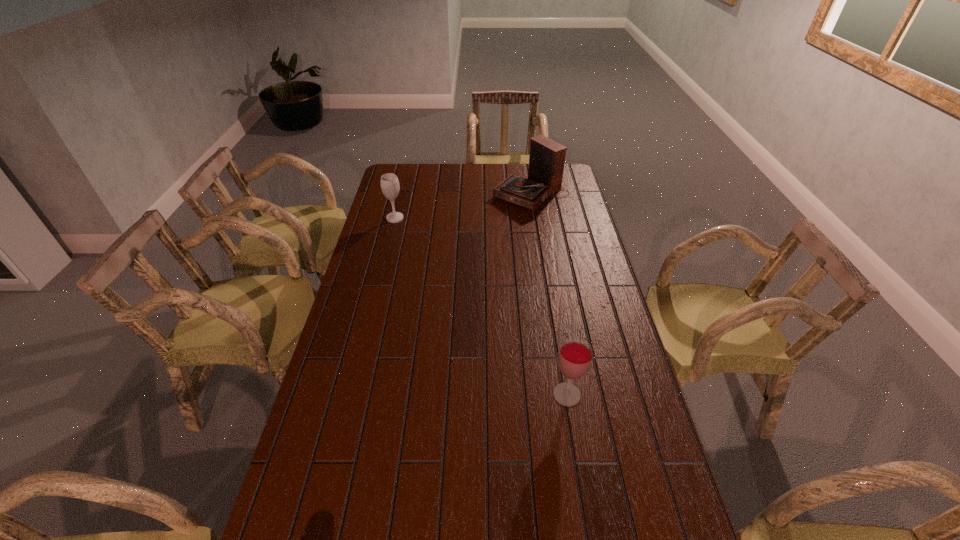
Locate an element on the screen. This screenshot has width=960, height=540. phonograph record is located at coordinates (546, 160).

At what (x,y) coordinates should I click in order to perform the action: click on the second farthest object. Please return your answer as a coordinate pair (x, y). The width and height of the screenshot is (960, 540). Looking at the image, I should click on (390, 187).

Identify the location of the farther wineglass. This screenshot has height=540, width=960. (390, 187).

Locate an element on the screen. the nearest object is located at coordinates [575, 356].

Locate an element on the screen. The width and height of the screenshot is (960, 540). the right wineglass is located at coordinates (575, 356).

Find the location of a particular element. The image size is (960, 540). free location located 0.320m on the front of the farthest object is located at coordinates (541, 258).

Locate an element on the screen. vacant area located 0.080m on the front of the farther wineglass is located at coordinates (391, 234).

Find the location of `free space located on the back of the right wineglass`. free space located on the back of the right wineglass is located at coordinates (552, 303).

What are the coordinates of `object situated at the far edge` in the screenshot? It's located at (546, 160).

Where is `object that is at the left edge`? This screenshot has width=960, height=540. object that is at the left edge is located at coordinates pos(390,187).